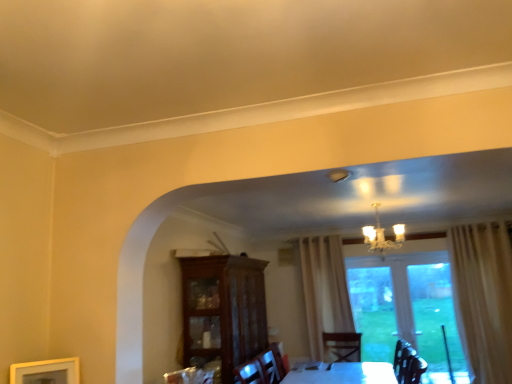
Question: Considering the relative sizes of mahogany glass-front cabinet at center and gold metallic chandelier at upper center in the image provided, is mahogany glass-front cabinet at center bigger than gold metallic chandelier at upper center?

Choices:
 (A) no
 (B) yes

Answer: (B)

Question: Considering the relative sizes of mahogany glass-front cabinet at center and gold metallic chandelier at upper center in the image provided, is mahogany glass-front cabinet at center taller than gold metallic chandelier at upper center?

Choices:
 (A) no
 (B) yes

Answer: (B)

Question: From the image's perspective, would you say mahogany glass-front cabinet at center is shown under gold metallic chandelier at upper center?

Choices:
 (A) yes
 (B) no

Answer: (A)

Question: Does mahogany glass-front cabinet at center have a greater width compared to gold metallic chandelier at upper center?

Choices:
 (A) yes
 (B) no

Answer: (A)

Question: Is mahogany glass-front cabinet at center smaller than gold metallic chandelier at upper center?

Choices:
 (A) yes
 (B) no

Answer: (B)

Question: Is mahogany glass-front cabinet at center further to camera compared to gold metallic chandelier at upper center?

Choices:
 (A) no
 (B) yes

Answer: (A)

Question: Can you confirm if transparent glass door at center is bigger than gold metallic chandelier at upper center?

Choices:
 (A) no
 (B) yes

Answer: (B)

Question: Does transparent glass door at center touch gold metallic chandelier at upper center?

Choices:
 (A) yes
 (B) no

Answer: (B)

Question: Is the depth of transparent glass door at center greater than that of gold metallic chandelier at upper center?

Choices:
 (A) no
 (B) yes

Answer: (B)

Question: Considering the relative sizes of transparent glass door at center and gold metallic chandelier at upper center in the image provided, is transparent glass door at center taller than gold metallic chandelier at upper center?

Choices:
 (A) yes
 (B) no

Answer: (A)

Question: From a real-world perspective, does transparent glass door at center sit lower than gold metallic chandelier at upper center?

Choices:
 (A) yes
 (B) no

Answer: (A)

Question: Considering the relative sizes of transparent glass door at center and gold metallic chandelier at upper center in the image provided, is transparent glass door at center smaller than gold metallic chandelier at upper center?

Choices:
 (A) no
 (B) yes

Answer: (A)

Question: Is gold metallic chandelier at upper center positioned behind wooden picture frame at lower left?

Choices:
 (A) no
 (B) yes

Answer: (B)